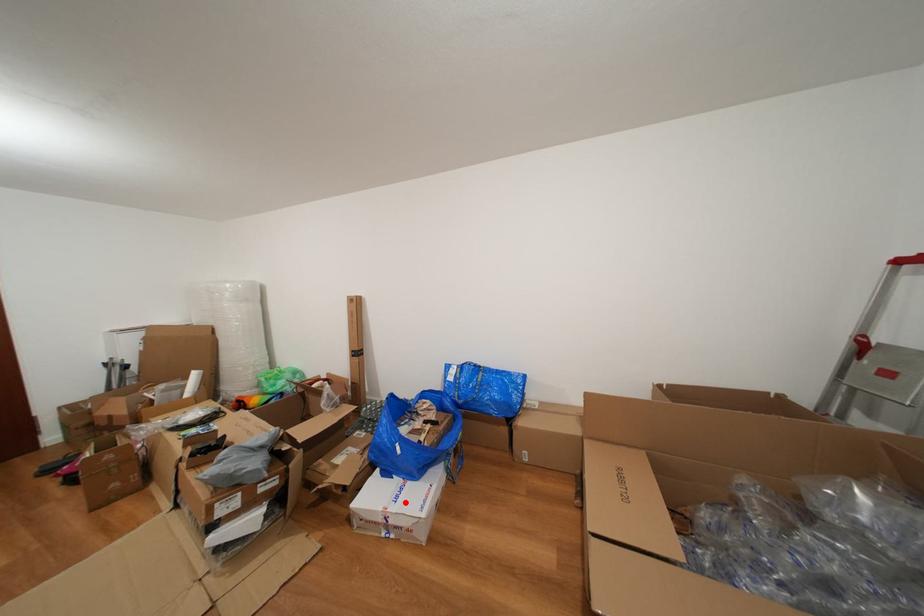
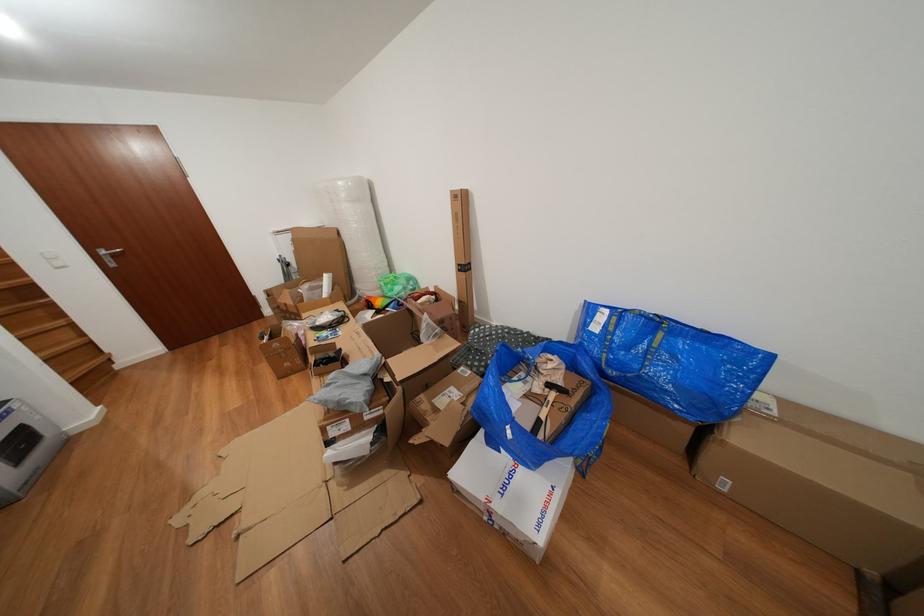
The point at the highlighted location is marked in the first image. Where is the corresponding point in the second image?

(513, 493)